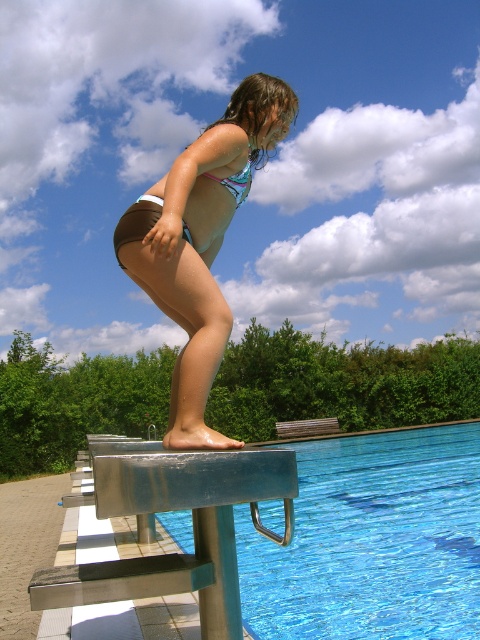
Is blue glassy water at center positioned at the back of pink shiny bikini at center?

Yes, it is behind pink shiny bikini at center.

Is blue glassy water at center closer to camera compared to pink shiny bikini at center?

No.

Does point (338, 525) lie in front of point (237, 168)?

No.

Identify the location of blue glassy water at center. (372, 541).

Is matte blue bikini at center to the left of pink shiny bikini at center from the viewer's perspective?

Correct, you'll find matte blue bikini at center to the left of pink shiny bikini at center.

Between matte blue bikini at center and pink shiny bikini at center, which one has less height?

A: pink shiny bikini at center

The width and height of the screenshot is (480, 640). Describe the element at coordinates (201, 241) in the screenshot. I see `matte blue bikini at center` at that location.

In order to click on matte blue bikini at center in this screenshot , I will do `click(201, 241)`.

Is blue glassy water at center positioned in front of matte blue bikini at center?

No, it is behind matte blue bikini at center.

The width and height of the screenshot is (480, 640). What do you see at coordinates (372, 541) in the screenshot? I see `blue glassy water at center` at bounding box center [372, 541].

You are a GUI agent. You are given a task and a screenshot of the screen. Output one action in this format:
    pyautogui.click(x=<x>, y=<y>)
    Task: Click on the blue glassy water at center
    This screenshot has width=480, height=640.
    Given the screenshot: What is the action you would take?
    pyautogui.click(x=372, y=541)

What are the coordinates of `blue glassy water at center` in the screenshot? It's located at (372, 541).